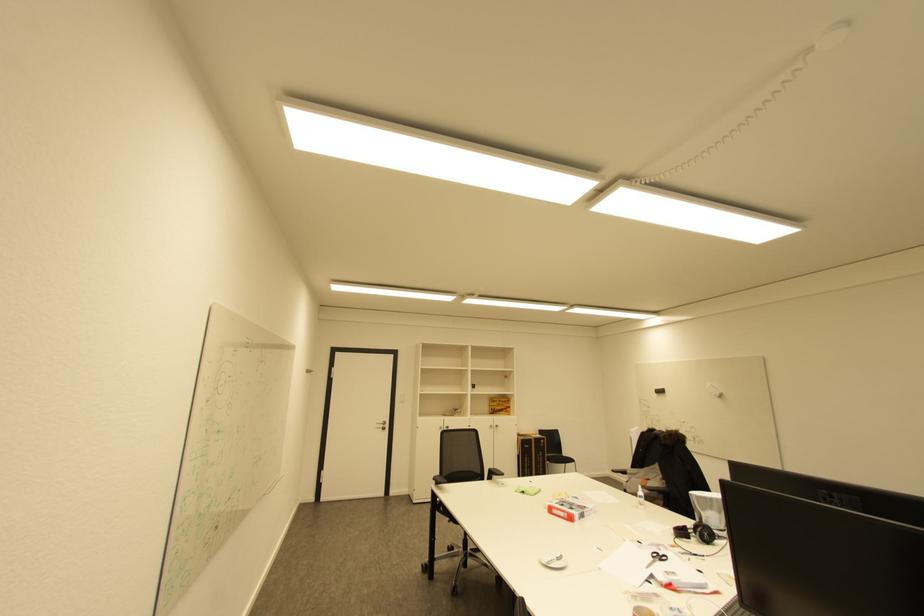
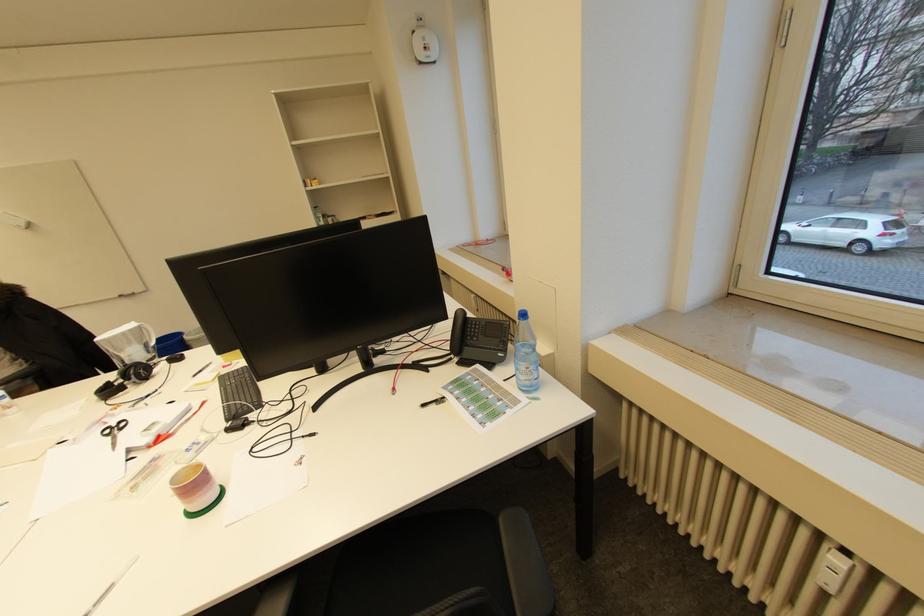
Find the pixel in the second image that matches [670,556] in the first image.

(127, 422)